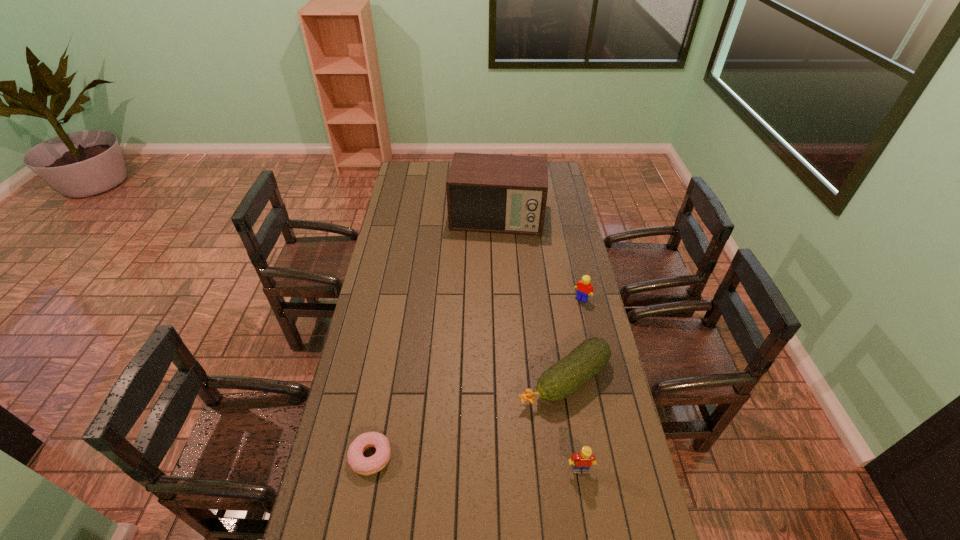
Identify the location of radio receiver that is at the right edge. (493, 193).

Locate an element on the screen. This screenshot has width=960, height=540. cucumber that is at the right edge is located at coordinates (563, 378).

In the image, there is a desktop. Identify the location of free space at the near edge. This screenshot has width=960, height=540. (391, 509).

Find the location of `free spot at the left edge of the desktop`. free spot at the left edge of the desktop is located at coordinates (400, 211).

Find the location of a particular element. The height and width of the screenshot is (540, 960). free region at the right edge of the desktop is located at coordinates (553, 294).

Image resolution: width=960 pixels, height=540 pixels. Find the location of `blank space at the far left corner`. blank space at the far left corner is located at coordinates (420, 164).

Where is `vacant space that's between the farthest object and the nearer Lego`? vacant space that's between the farthest object and the nearer Lego is located at coordinates (539, 343).

At what (x,y) coordinates should I click in order to perform the action: click on free area in between the fourth nearest object and the radio receiver. Please return your answer as a coordinate pair (x, y). This screenshot has width=960, height=540. Looking at the image, I should click on (540, 258).

The image size is (960, 540). Find the location of `empty space between the nearer Lego and the fourth tallest object`. empty space between the nearer Lego and the fourth tallest object is located at coordinates (572, 424).

Find the location of a particular element. vacant point located between the right Lego and the farthest object is located at coordinates (540, 258).